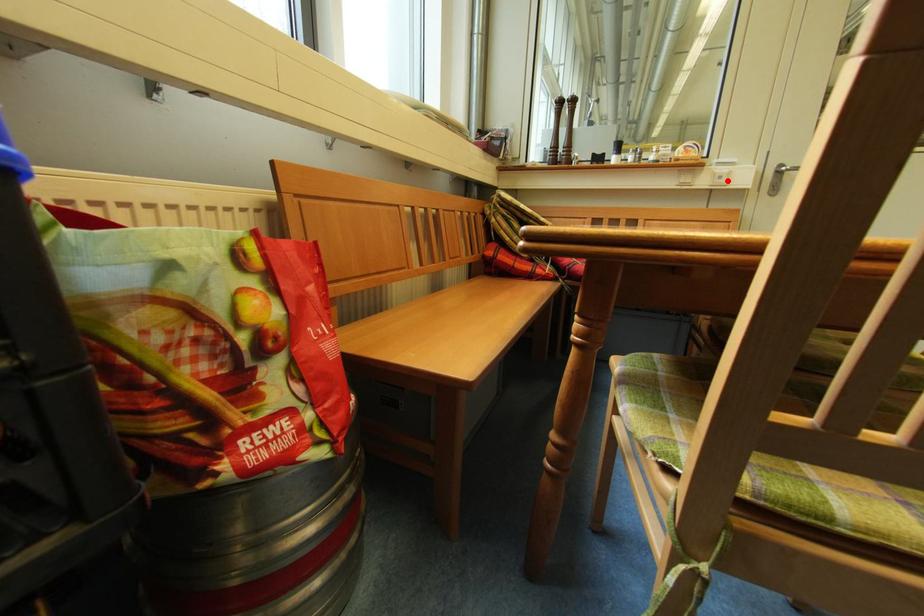
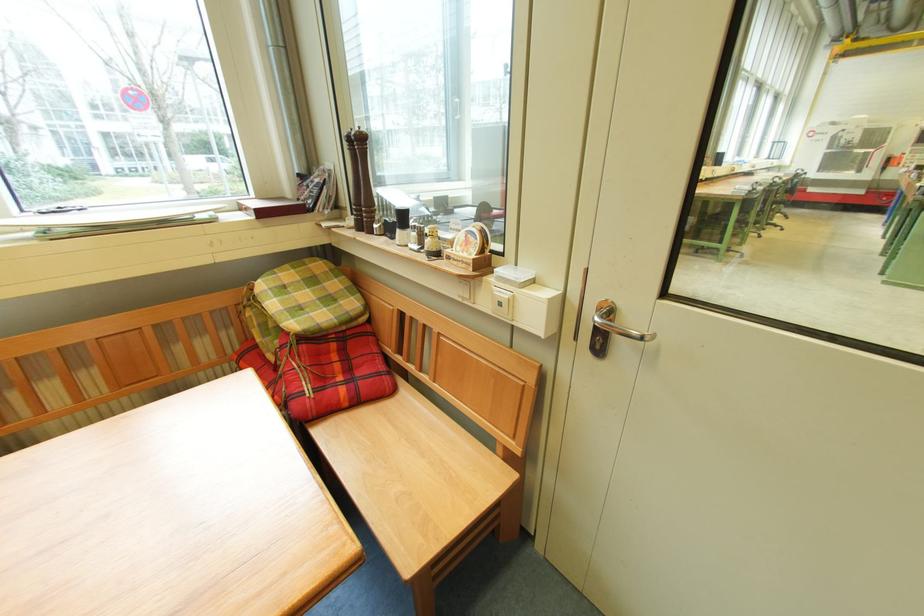
Find the pixel in the second image that matches the highlighted location in the first image.

(507, 307)